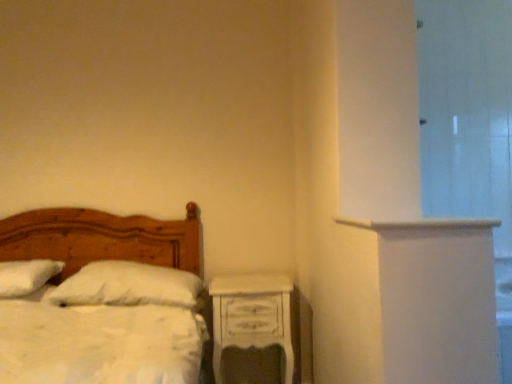
Question: Is white soft pillow at center, arranged as the 1th pillow when viewed from the right, taller or shorter than wooden bed at left?

Choices:
 (A) short
 (B) tall

Answer: (A)

Question: Is white soft pillow at center, arranged as the 1th pillow when viewed from the right, inside the boundaries of wooden bed at left, or outside?

Choices:
 (A) outside
 (B) inside

Answer: (B)

Question: Based on their relative distances, which object is nearer to the white soft pillow at center, which ranks as the 2th pillow in left-to-right order?

Choices:
 (A) white painted wood nightstand at lower right
 (B) wooden bed at left
 (C) white fluffy pillow at left, which ranks as the 2th pillow in right-to-left order
 (D) transparent glass door at right
 (E) white painted wood ledge at upper right

Answer: (B)

Question: Which is nearer to the white fluffy pillow at left, marked as the 1th pillow in a left-to-right arrangement?

Choices:
 (A) white painted wood nightstand at lower right
 (B) transparent glass door at right
 (C) wooden bed at left
 (D) white soft pillow at center, which ranks as the 2th pillow in left-to-right order
 (E) white painted wood ledge at upper right

Answer: (C)